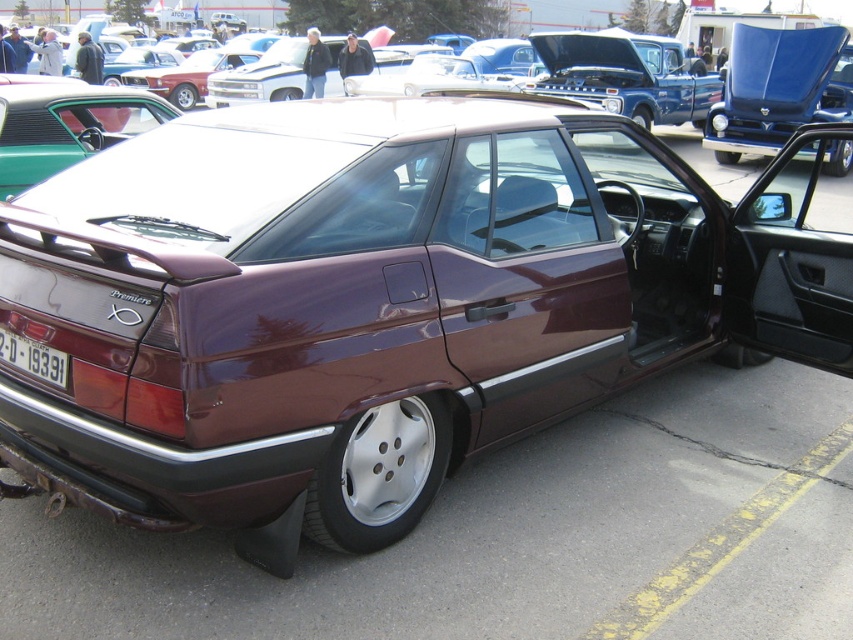
You are standing in front of the Chevrolet Lumina Premiere at the car show. You notice two points marked on the car. The first point is at coordinates point [724,76] and the second point is at point [4,349]. Which point is closer to you, the observer?

Point [724,76] is further to the camera than point [4,349], so the point closer to you is point [4,349].

You are a car enthusiast who wants to inspect the shiny blue hood at upper right and the satin burgundy sedan at center. Which part is located lower in the image?

The shiny blue hood at upper right is positioned under the satin burgundy sedan at center, so it is lower in the image.

You are a photographer standing at the center of the car show. You want to take a photo of the satin burgundy sedan at center and the white plastic license plate at rear in the same frame. Given that your camera has a focal length of 50mm and a field of view of 46 degrees, can both objects be captured in a single shot without moving the camera?

The distance between the satin burgundy sedan at center and the white plastic license plate at rear is 13.19 meters. To determine if they can fit in a 46 degree field of view, we calculate the maximum distance spannable at 50mm. Using trigonometry, the maximum width at the subject distance would be 2 times the focal length times the tangent of half the field of view. However, since the sedan and license plate are at the same distance from the camera, the 13.19 meters separation exceeds typical 50mm field of